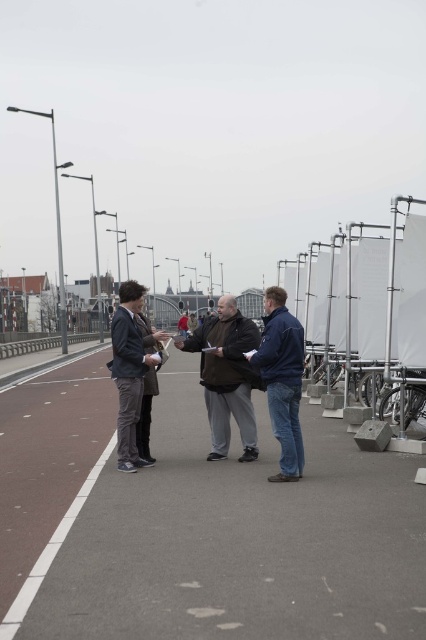
You are standing at the point marked by coordinates point (x=282, y=380) in the image. What is the nearest object to you?

The point (x=282, y=380) corresponds to the dark blue jacket at center, so the nearest object to you is the dark blue jacket at center.